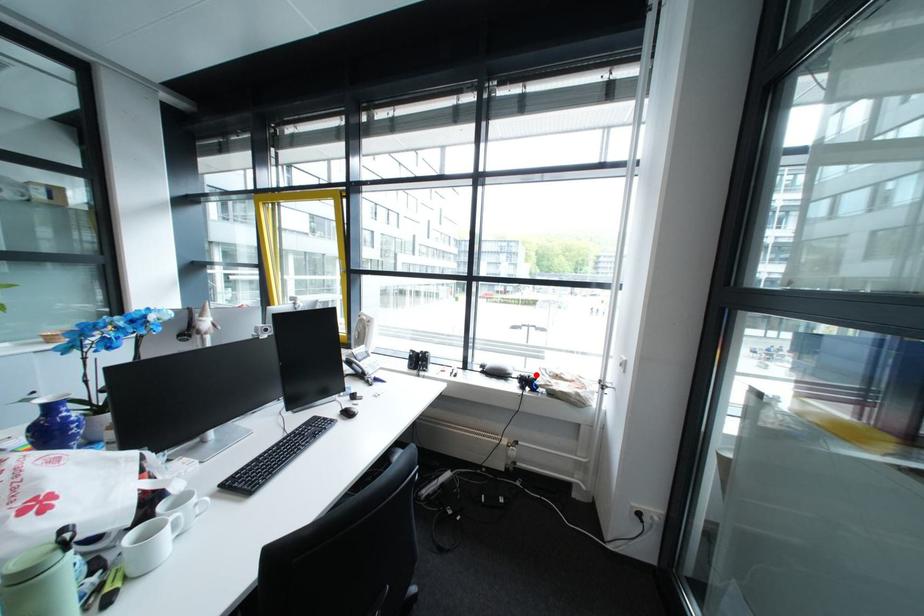
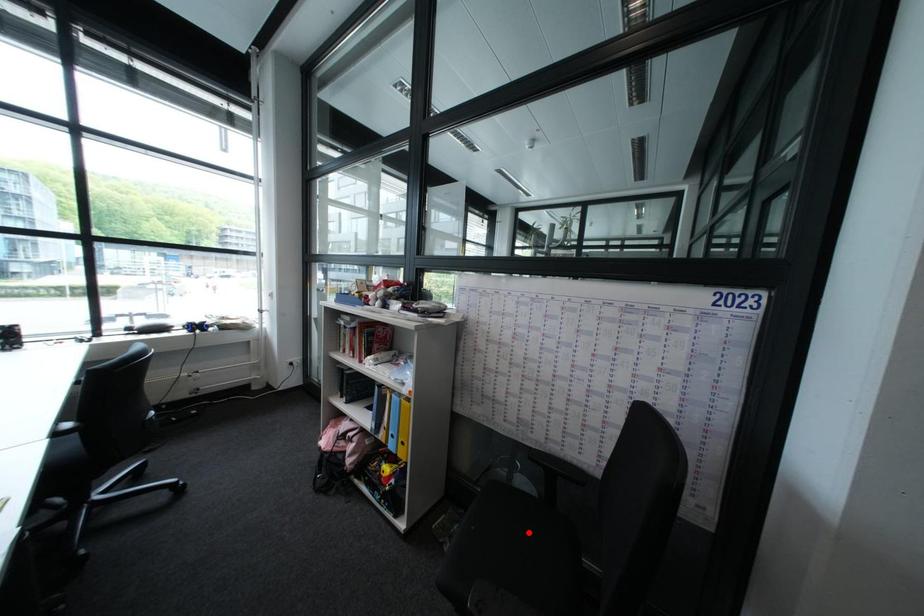
I am providing you with two images of the same scene from different viewpoints. A red point is marked on the first image and another point is marked on the second image. Does the point marked in image1 correspond to the same location as the one in image2?

No